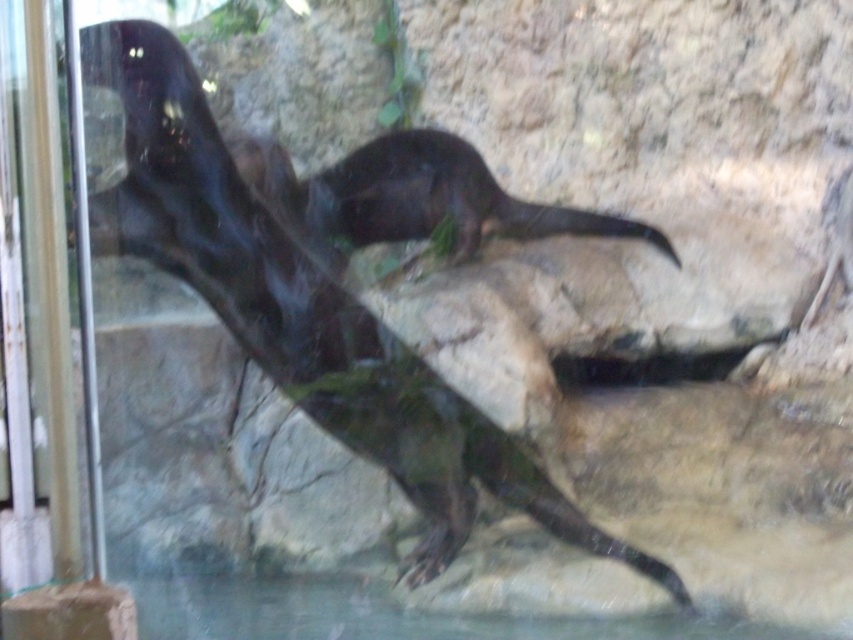
Which is below, shiny black otter at center or shiny dark fur otter at center?

shiny black otter at center

Which is in front, point (383, 360) or point (260, 189)?

Point (383, 360) is more forward.

Does point (180, 68) lie in front of point (538, 211)?

Yes, point (180, 68) is in front of point (538, 211).

The width and height of the screenshot is (853, 640). Find the location of `shiny black otter at center`. shiny black otter at center is located at coordinates (332, 282).